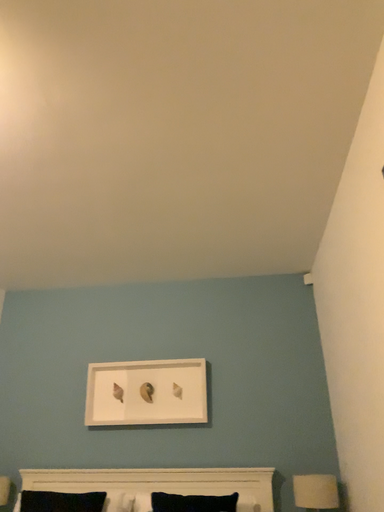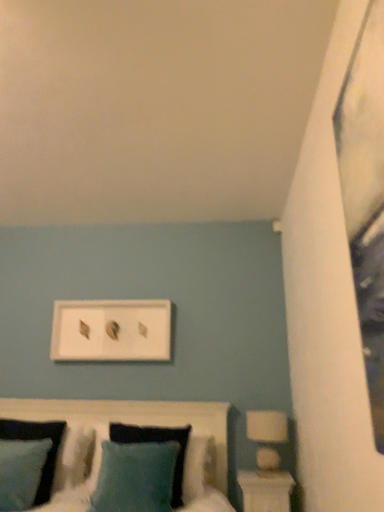
Question: Which way did the camera rotate in the video?

Choices:
 (A) rotated upward
 (B) rotated downward

Answer: (B)